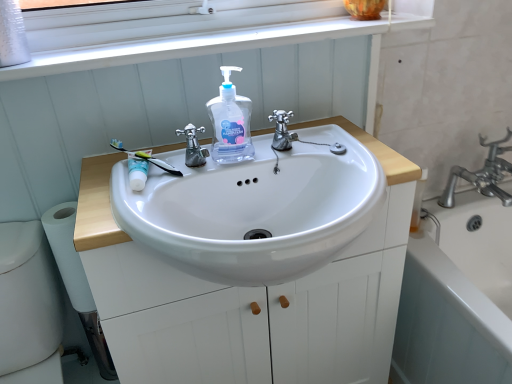
The height and width of the screenshot is (384, 512). Find the location of `vacant space positioned to the left of white glossy mouthwash at upper left`. vacant space positioned to the left of white glossy mouthwash at upper left is located at coordinates (98, 174).